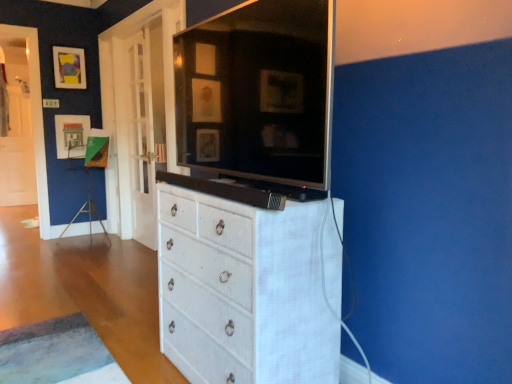
Where is `free point above white glass door at left (from a real-world perspective)`? The height and width of the screenshot is (384, 512). free point above white glass door at left (from a real-world perspective) is located at coordinates (133, 34).